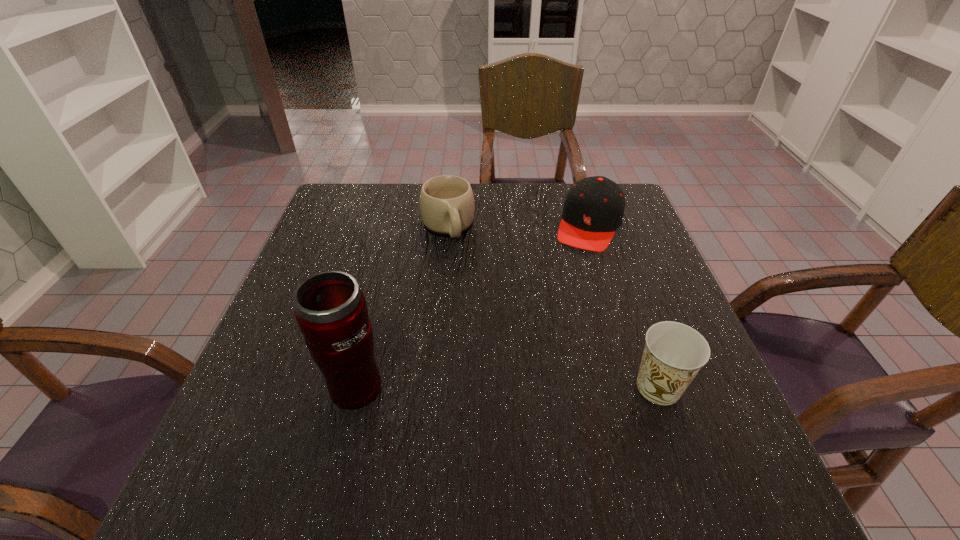
Find the location of a particular element. The image size is (960, 540). the tallest object is located at coordinates (331, 311).

In order to click on thermos bottle in this screenshot , I will do `click(331, 311)`.

Identify the location of Dixie cup. (674, 353).

The width and height of the screenshot is (960, 540). What are the coordinates of `the second object from left to right` in the screenshot? It's located at (447, 205).

Where is `cap`? The width and height of the screenshot is (960, 540). cap is located at coordinates (593, 210).

Locate an element on the screen. free space located 0.110m on the side with the handle of the thermos bottle is located at coordinates (263, 386).

Locate an element on the screen. The width and height of the screenshot is (960, 540). vacant space situated on the left of the Dixie cup is located at coordinates (531, 387).

Find the location of a particular element. Image resolution: width=960 pixels, height=540 pixels. free space located 0.320m on the side of the second object from left to right with the handle is located at coordinates (488, 338).

Locate an element on the screen. free spot located on the side of the second object from left to right with the handle is located at coordinates (472, 296).

Where is `free point located 0.390m on the side of the second object from left to right with the handle`? The width and height of the screenshot is (960, 540). free point located 0.390m on the side of the second object from left to right with the handle is located at coordinates (498, 363).